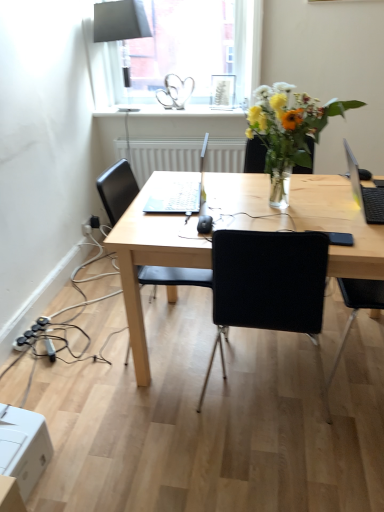
Question: Is sleek silver laptop at center thinner than matte black lampshade at upper center?

Choices:
 (A) no
 (B) yes

Answer: (A)

Question: Is sleek silver laptop at center aimed at matte black lampshade at upper center?

Choices:
 (A) yes
 (B) no

Answer: (B)

Question: Is sleek silver laptop at center closer to camera compared to matte black lampshade at upper center?

Choices:
 (A) yes
 (B) no

Answer: (A)

Question: Does sleek silver laptop at center have a lesser height compared to matte black lampshade at upper center?

Choices:
 (A) yes
 (B) no

Answer: (A)

Question: From the image's perspective, would you say sleek silver laptop at center is positioned over matte black lampshade at upper center?

Choices:
 (A) no
 (B) yes

Answer: (A)

Question: From a real-world perspective, is transparent glass window at upper center positioned above or below black plastic chair at center?

Choices:
 (A) below
 (B) above

Answer: (B)

Question: From the image's perspective, relative to black plastic chair at center, is transparent glass window at upper center above or below?

Choices:
 (A) below
 (B) above

Answer: (B)

Question: Is point coord(147,39) positioned closer to the camera than point coord(175,270)?

Choices:
 (A) farther
 (B) closer

Answer: (A)

Question: In terms of width, does transparent glass window at upper center look wider or thinner when compared to black plastic chair at center?

Choices:
 (A) thin
 (B) wide

Answer: (A)

Question: Is light wood desk at center to the left or to the right of black plastic chair at center in the image?

Choices:
 (A) left
 (B) right

Answer: (B)

Question: Is light wood desk at center wider or thinner than black plastic chair at center?

Choices:
 (A) wide
 (B) thin

Answer: (A)

Question: In the image, is light wood desk at center positioned in front of or behind black plastic chair at center?

Choices:
 (A) front
 (B) behind

Answer: (A)

Question: Looking at the image, does light wood desk at center seem bigger or smaller compared to black plastic chair at center?

Choices:
 (A) big
 (B) small

Answer: (A)

Question: Is point (362, 212) positioned closer to the camera than point (18, 411)?

Choices:
 (A) farther
 (B) closer

Answer: (A)

Question: From the image's perspective, is black matte laptop at right above or below white cardboard box at lower left?

Choices:
 (A) above
 (B) below

Answer: (A)